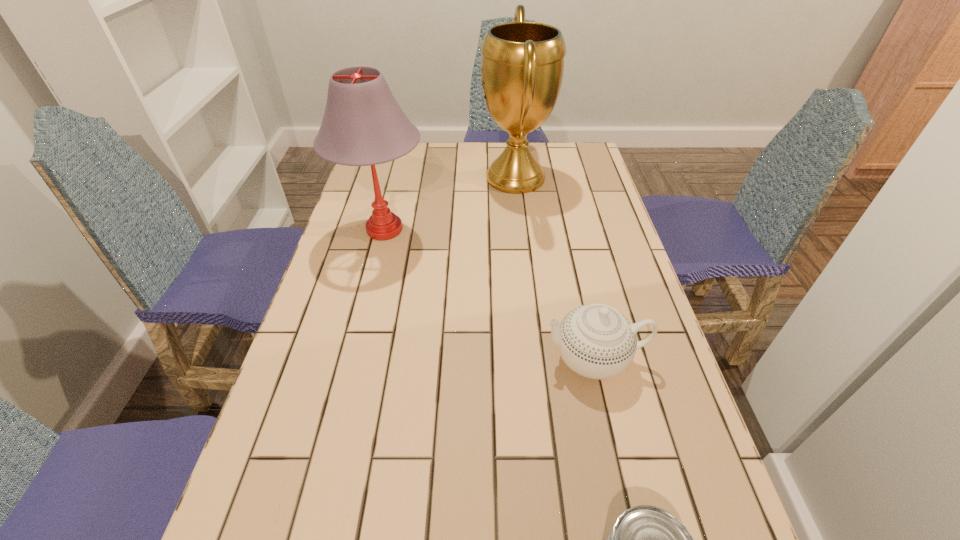
Locate an element on the screen. Image resolution: width=960 pixels, height=540 pixels. trophy cup is located at coordinates (522, 65).

The height and width of the screenshot is (540, 960). What are the coordinates of `the leftmost object` in the screenshot? It's located at click(363, 124).

Where is `chinaware`? This screenshot has height=540, width=960. chinaware is located at coordinates (596, 341).

What are the coordinates of `the second shortest object` in the screenshot? It's located at (596, 341).

You are a GUI agent. You are given a task and a screenshot of the screen. Output one action in this format:
    pyautogui.click(x=<x>, y=<y>)
    Task: Click on the free location located 0.290m on the surface of the trophy cup with symbols
    Image resolution: width=960 pixels, height=540 pixels.
    Given the screenshot: What is the action you would take?
    pyautogui.click(x=396, y=178)

Identify the location of vacant area situated on the surface of the trophy cup with symbols. (416, 178).

Identify the location of blank space located on the surface of the trophy cup with symbols. (463, 178).

This screenshot has width=960, height=540. In order to click on vacant space located on the front-facing side of the leftmost object in this screenshot , I will do `click(551, 230)`.

Locate an element on the screen. The height and width of the screenshot is (540, 960). blank space located on the spout of the second nearest object is located at coordinates (424, 359).

The width and height of the screenshot is (960, 540). What are the coordinates of `vacant space located 0.390m on the spout of the second nearest object` in the screenshot? It's located at (365, 359).